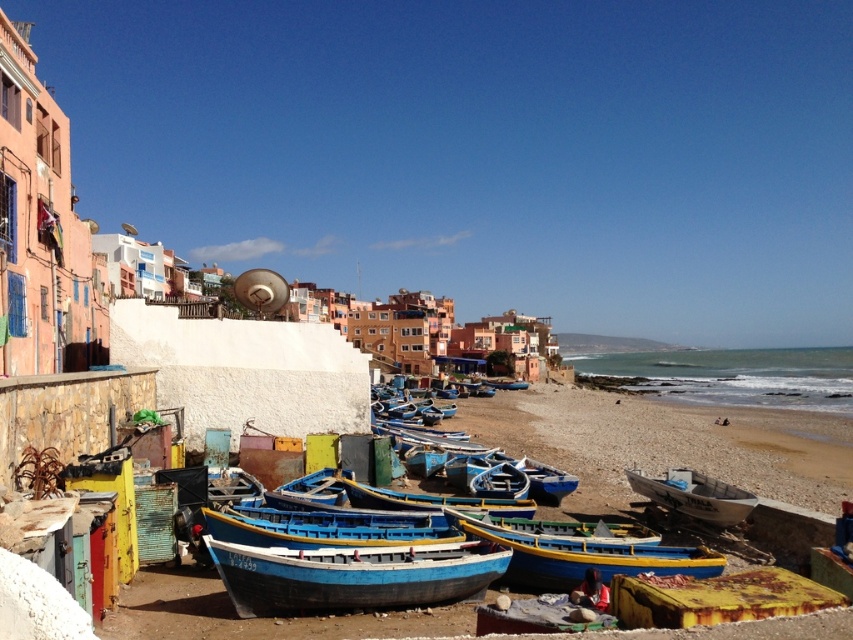
Question: Which point is farther to the camera?

Choices:
 (A) (697, 509)
 (B) (439, 556)
 (C) (422, 499)
 (D) (703, 557)

Answer: (A)

Question: Which point is closer to the camera?

Choices:
 (A) (711, 522)
 (B) (523, 502)

Answer: (A)

Question: Is yellow painted wood canoe at center thinner than white matte boat at center?

Choices:
 (A) yes
 (B) no

Answer: (A)

Question: Is blue painted wood boat at lower center to the right of yellow painted wood canoe at center from the viewer's perspective?

Choices:
 (A) no
 (B) yes

Answer: (A)

Question: Which object is farther from the camera taking this photo?

Choices:
 (A) white matte boat at center
 (B) blue painted wood boat at lower center
 (C) yellow painted wood canoe at center

Answer: (A)

Question: Considering the relative positions of yellow painted wood canoe at center and blue painted wood canoe at center in the image provided, where is yellow painted wood canoe at center located with respect to blue painted wood canoe at center?

Choices:
 (A) below
 (B) above

Answer: (A)